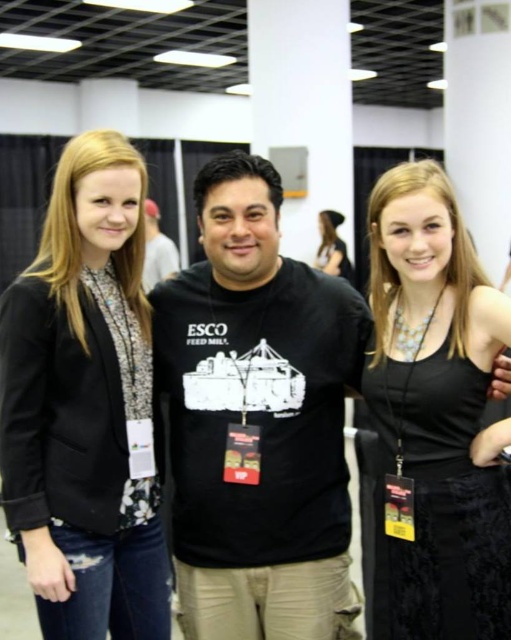
Question: Based on their relative distances, which object is farther from the black velvet dress at center?

Choices:
 (A) black matte blazer at left
 (B) black matte t-shirt at center
 (C) black matte shirt at center

Answer: (C)

Question: Is black matte blazer at left to the right of black velvet dress at center from the viewer's perspective?

Choices:
 (A) yes
 (B) no

Answer: (B)

Question: Considering the relative positions of black matte t-shirt at center and black matte shirt at center in the image provided, where is black matte t-shirt at center located with respect to black matte shirt at center?

Choices:
 (A) right
 (B) left

Answer: (A)

Question: Can you confirm if black velvet dress at center is wider than blonde hair at upper right?

Choices:
 (A) yes
 (B) no

Answer: (B)

Question: Among these objects, which one is farthest from the camera?

Choices:
 (A) black velvet dress at center
 (B) black matte t-shirt at center
 (C) black matte blazer at left

Answer: (B)

Question: Among these points, which one is farthest from the camera?

Choices:
 (A) (60, 458)
 (B) (383, 372)

Answer: (A)